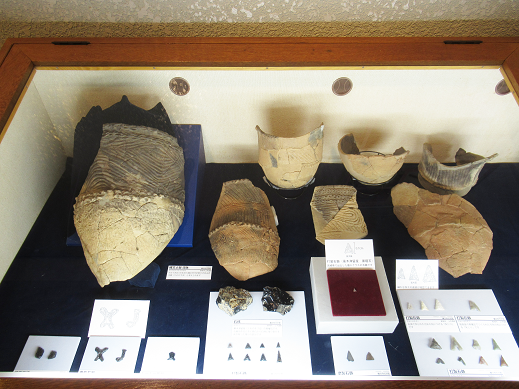
Locate an element on the screen. Image resolution: width=519 pixels, height=389 pixels. blue cloth at bottom of display case is located at coordinates (45, 308).